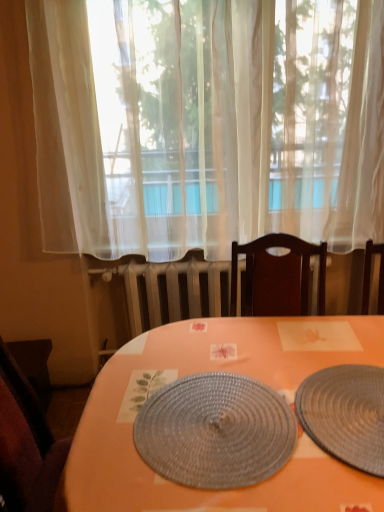
Question: Which direction should I rotate to look at rattan placemat at center, acting as the second plate starting from the left?

Choices:
 (A) right
 (B) left

Answer: (A)

Question: Considering the relative sizes of orange matte placemat at center and woven gray placemat at center, which is counted as the 1th plate, starting from the left, in the image provided, is orange matte placemat at center bigger than woven gray placemat at center, which is counted as the 1th plate, starting from the left,?

Choices:
 (A) no
 (B) yes

Answer: (B)

Question: From the image's perspective, does orange matte placemat at center appear lower than woven gray placemat at center, which is counted as the 1th plate, starting from the left?

Choices:
 (A) yes
 (B) no

Answer: (A)

Question: Would you say orange matte placemat at center contains woven gray placemat at center, which is counted as the 1th plate, starting from the left?

Choices:
 (A) yes
 (B) no

Answer: (A)

Question: From a real-world perspective, is orange matte placemat at center below woven gray placemat at center, which is counted as the 1th plate, starting from the left?

Choices:
 (A) yes
 (B) no

Answer: (A)

Question: Does orange matte placemat at center have a greater height compared to woven gray placemat at center, which is counted as the 1th plate, starting from the left?

Choices:
 (A) no
 (B) yes

Answer: (B)

Question: Is orange matte placemat at center looking in the opposite direction of woven gray placemat at center, which is counted as the 1th plate, starting from the left?

Choices:
 (A) no
 (B) yes

Answer: (A)

Question: From the image's perspective, is dark brown wooden chair at lower left on rattan placemat at center, acting as the second plate starting from the left?

Choices:
 (A) no
 (B) yes

Answer: (A)

Question: Does dark brown wooden chair at lower left have a larger size compared to rattan placemat at center, acting as the second plate starting from the left?

Choices:
 (A) no
 (B) yes

Answer: (B)

Question: Is dark brown wooden chair at lower left to the left of rattan placemat at center, acting as the second plate starting from the left, from the viewer's perspective?

Choices:
 (A) yes
 (B) no

Answer: (A)

Question: Can you confirm if dark brown wooden chair at lower left is thinner than rattan placemat at center, positioned as the first plate in right-to-left order?

Choices:
 (A) no
 (B) yes

Answer: (B)

Question: From a real-world perspective, does dark brown wooden chair at lower left sit lower than rattan placemat at center, positioned as the first plate in right-to-left order?

Choices:
 (A) no
 (B) yes

Answer: (B)

Question: Could you tell me if dark brown wooden chair at lower left is turned towards rattan placemat at center, positioned as the first plate in right-to-left order?

Choices:
 (A) yes
 (B) no

Answer: (B)

Question: Is white sheer curtain at center outside dark brown wooden chair at lower left?

Choices:
 (A) yes
 (B) no

Answer: (A)